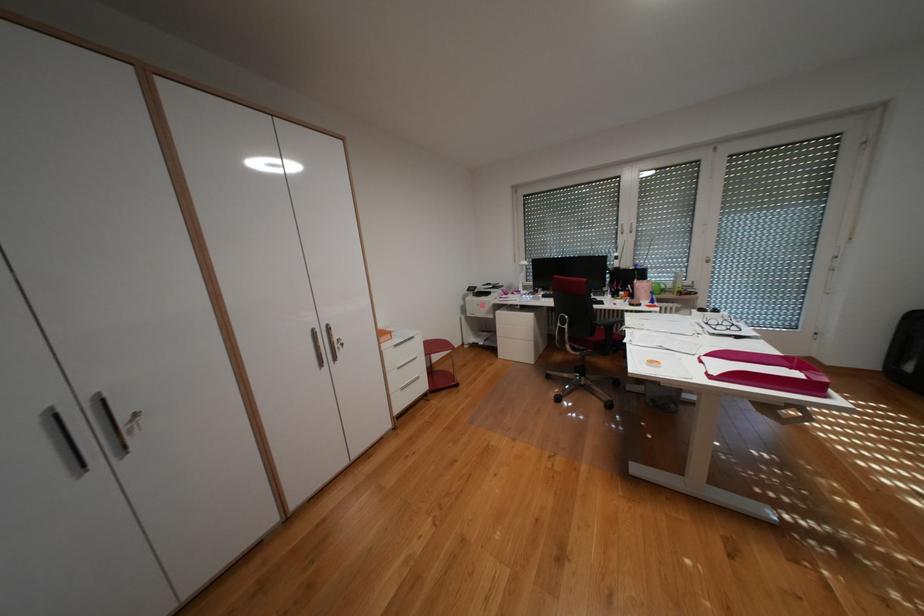
Where is `red paper tray`? The width and height of the screenshot is (924, 616). red paper tray is located at coordinates (766, 371).